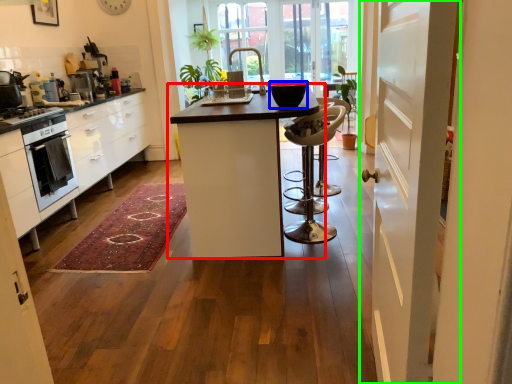
Question: Based on their relative distances, which object is nearer to table (highlighted by a red box)? Choose from appliance (highlighted by a blue box) and door (highlighted by a green box).

Choices:
 (A) appliance
 (B) door

Answer: (A)